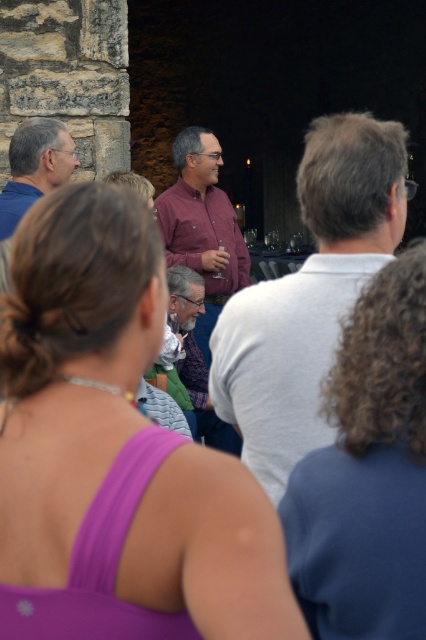
You are a photographer at the event and want to capture a photo of both the purple fabric top at center and the curly hair at center. Since the camera can only focus on one subject clearly, which one should you choose to ensure it appears more prominent in the photo?

The purple fabric top at center is larger in size than the curly hair at center, so you should focus on the purple fabric top at center to ensure it appears more prominent in the photo.

You are organizing a group photo and need to arrange people based on their shirt sizes. If you have the matte purple shirt at center and the matte gray shirt at left, which shirt should be placed in the front row to ensure visibility?

The matte gray shirt at left should be placed in the front row because it is smaller in size compared to the matte purple shirt at center, allowing the larger matte purple shirt at center to be visible behind it.

You are a photographer at the event and want to capture a photo that includes both the curly hair at center and the matte pink shirt at center. Since the camera can only focus on one subject at a time, which person should you focus on to ensure their full height is visible in the frame?

You should focus on the matte pink shirt at center because it is taller than the curly hair at center, ensuring their full height is visible in the frame.